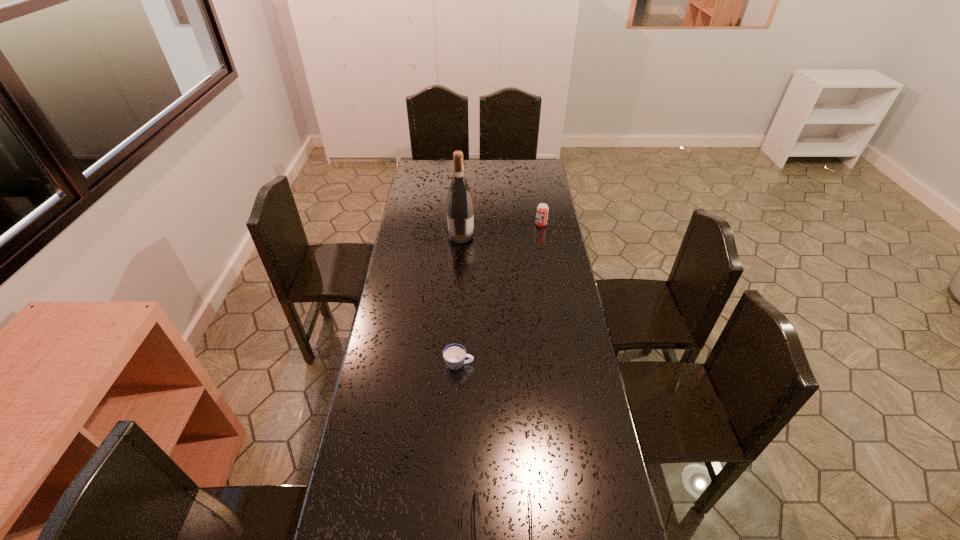
What are the coordinates of `free space at the far edge of the desktop` in the screenshot? It's located at (468, 161).

Find the location of a particular element. The width and height of the screenshot is (960, 540). vacant space at the left edge of the desktop is located at coordinates (411, 209).

The width and height of the screenshot is (960, 540). In the image, there is a desktop. Find the location of `vacant region at the right edge`. vacant region at the right edge is located at coordinates (554, 446).

In the image, there is a desktop. At what (x,y) coordinates should I click in order to perform the action: click on vacant space at the far right corner. Please return your answer as a coordinate pair (x, y). The width and height of the screenshot is (960, 540). Looking at the image, I should click on (518, 166).

The height and width of the screenshot is (540, 960). What are the coordinates of `vacant area between the second shortest object and the tallest object` in the screenshot? It's located at (460, 300).

Find the location of a particular element. free space that is in between the second shortest object and the rightmost object is located at coordinates (500, 294).

Locate an element on the screen. free space between the soda can and the third nearest object is located at coordinates (501, 230).

Where is `free space between the wine bottle and the farthest object`? The height and width of the screenshot is (540, 960). free space between the wine bottle and the farthest object is located at coordinates (501, 230).

Where is `free point between the cup and the tallest object`? This screenshot has width=960, height=540. free point between the cup and the tallest object is located at coordinates (460, 300).

I want to click on vacant area that lies between the soda can and the third tallest object, so click(500, 294).